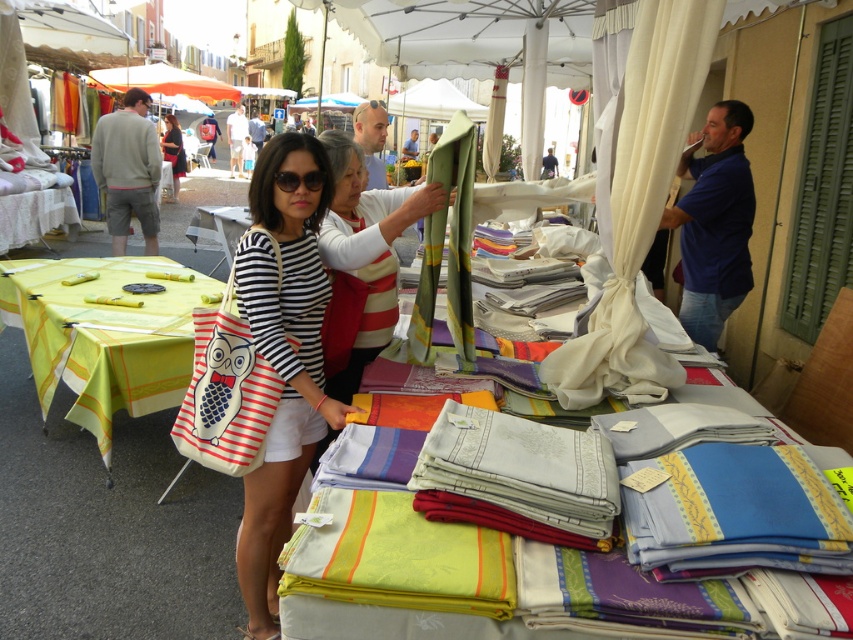
Does gray cotton shorts at left appear under green fabric at center?

No, gray cotton shorts at left is not below green fabric at center.

Which is in front, point (125, 244) or point (0, 234)?

Point (0, 234)

Locate an element on the screen. Image resolution: width=853 pixels, height=640 pixels. gray cotton shorts at left is located at coordinates (126, 170).

Is striped cotton bag at center further to camera compared to striped fabric bag at center?

No, striped cotton bag at center is closer to the viewer.

Is striped cotton bag at center smaller than striped fabric bag at center?

Indeed, striped cotton bag at center has a smaller size compared to striped fabric bag at center.

Is point (326, 304) behind point (173, 140)?

That is False.

Where is `striped cotton bag at center`? The height and width of the screenshot is (640, 853). striped cotton bag at center is located at coordinates (283, 353).

Which is behind, point (665, 214) or point (16, 228)?

The point (16, 228) is behind.

The image size is (853, 640). Identify the location of blue cotton shirt at right. (714, 221).